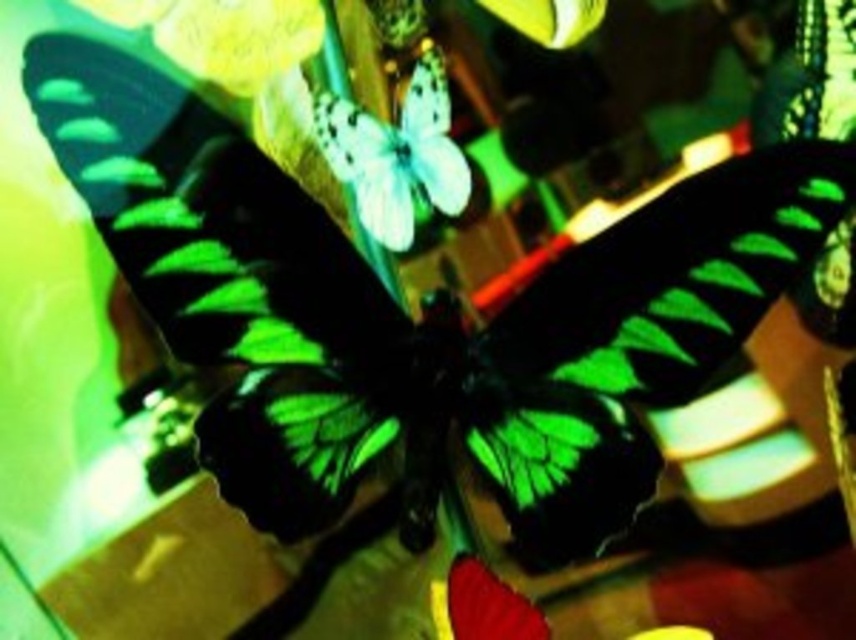
You are a photographer setting up a shoot with a matte yellow flower at upper left and a transparent glass vase at lower right. You want to ensure the flower is visible in the frame without being blocked by the vase. Based on the scene description, will the flower be visible?

The matte yellow flower at upper left is located above the transparent glass vase at lower right, so it will be visible in the frame as it is positioned higher than the vase.

You are an interior designer arranging a room and see the image. You want to place a small statue between the matte yellow flower at upper left and the transparent glass vase at lower right. Based on their positions, where should the statue be placed?

The matte yellow flower at upper left is to the left of transparent glass vase at lower right, so the statue should be placed between them horizontally, to the right of the matte yellow flower at upper left and to the left of the transparent glass vase at lower right.

You are a photographer trying to capture the white matte butterfly at center and the transparent glass vase at lower right in a single frame. Based on their sizes, which object should you focus on first to ensure both are in focus?

The white matte butterfly at center is larger in size than the transparent glass vase at lower right, so you should focus on the white matte butterfly at center first to ensure both are in focus.